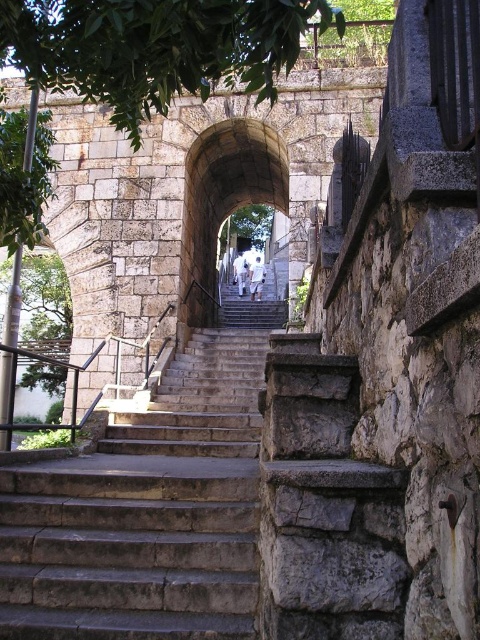
Is stone stairs at center above stone archway at center?

Actually, stone stairs at center is below stone archway at center.

Is point (216, 333) farther from camera compared to point (197, 285)?

No, (216, 333) is in front of (197, 285).

Identify the location of stone stairs at center. The height and width of the screenshot is (640, 480). (149, 506).

Identify the location of stone stairs at center. (149, 506).

Based on the photo, is stone archway at center further to camera compared to green leafy tree at center?

No, stone archway at center is closer to the viewer.

Is point (194, 161) positioned before point (244, 225)?

That is True.

Is point (276, 205) in front of point (257, 216)?

Yes.

At what (x,y) coordinates should I click in order to perform the action: click on stone archway at center. Please return your answer as a coordinate pair (x, y). The height and width of the screenshot is (640, 480). Looking at the image, I should click on (224, 198).

Is stone stairs at center taller than green leafy tree at left?

Incorrect, stone stairs at center's height is not larger of green leafy tree at left's.

Between point (16, 582) and point (15, 166), which one is positioned in front?

Point (16, 582)

Find the location of a particular element. The height and width of the screenshot is (640, 480). stone stairs at center is located at coordinates (149, 506).